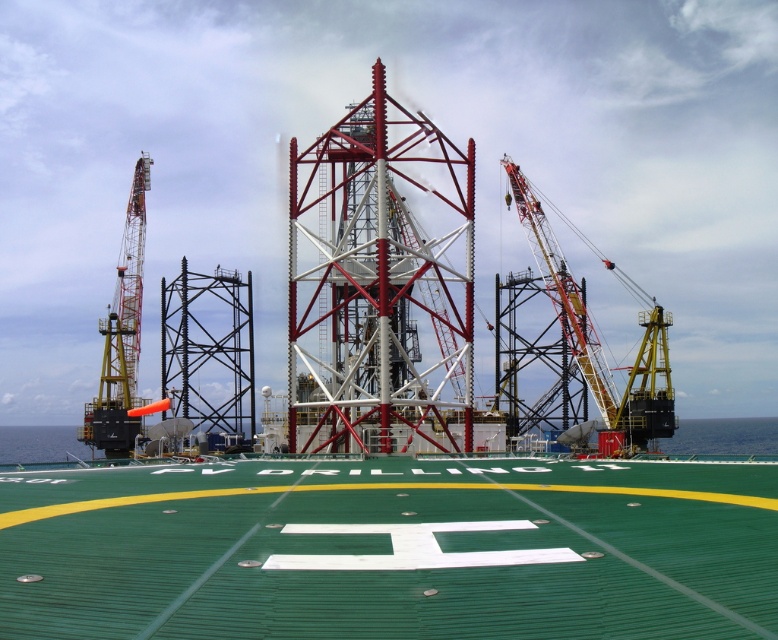
Does orange painted metal crane at right have a lesser width compared to yellow painted metal crane at left?

In fact, orange painted metal crane at right might be wider than yellow painted metal crane at left.

Is orange painted metal crane at right wider than yellow painted metal crane at left?

Yes, orange painted metal crane at right is wider than yellow painted metal crane at left.

Which is behind, point (561, 296) or point (139, 339)?

The point (139, 339) is behind.

The height and width of the screenshot is (640, 778). I want to click on orange painted metal crane at right, so click(x=562, y=292).

Can you confirm if metallic red and white tower at center is shorter than yellow painted metal crane at left?

Incorrect, metallic red and white tower at center's height does not fall short of yellow painted metal crane at left's.

The width and height of the screenshot is (778, 640). I want to click on metallic red and white tower at center, so click(x=379, y=282).

Between metallic red and white tower at center and orange painted metal crane at right, which one appears on the right side from the viewer's perspective?

orange painted metal crane at right is more to the right.

Does point (447, 294) come farther from viewer compared to point (594, 339)?

No, (447, 294) is in front of (594, 339).

Is point (468, 298) positioned behind point (552, 282)?

No, (468, 298) is closer to viewer.

Find the location of a particular element. metallic red and white tower at center is located at coordinates (379, 282).